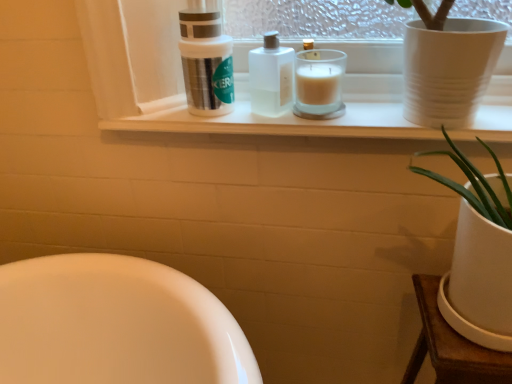
Image resolution: width=512 pixels, height=384 pixels. I want to click on free space to the left of silver metallic container at upper center, so click(x=160, y=117).